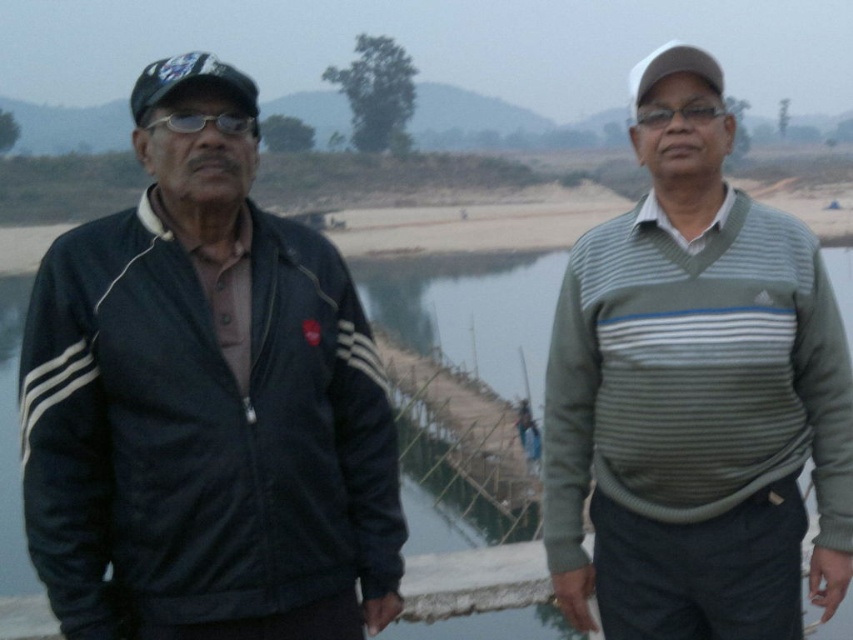
Measure the distance between greenish water at center and black matte glasses at left.

They are 14.38 meters apart.

Is the position of greenish water at center more distant than that of black matte glasses at left?

Yes, it is behind black matte glasses at left.

Which is in front, point (486, 260) or point (202, 118)?

Point (202, 118) is in front.

Find the location of a particular element. greenish water at center is located at coordinates (473, 310).

Is point (650, 138) farther from camera compared to point (244, 120)?

Yes, it is.

Which is more to the left, striped sweater at center or black matte glasses at left?

Positioned to the left is black matte glasses at left.

Is point (680, 128) farther from camera compared to point (236, 113)?

That is True.

What are the coordinates of `striped sweater at center` in the screenshot? It's located at (694, 394).

Is matte black jacket at left bigger than striped sweater at center?

Actually, matte black jacket at left might be smaller than striped sweater at center.

Looking at this image, can you confirm if matte black jacket at left is taller than striped sweater at center?

In fact, matte black jacket at left may be shorter than striped sweater at center.

Between point (173, 317) and point (706, 344), which one is positioned in front?

Point (173, 317)

Locate an element on the screen. matte black jacket at left is located at coordinates (206, 403).